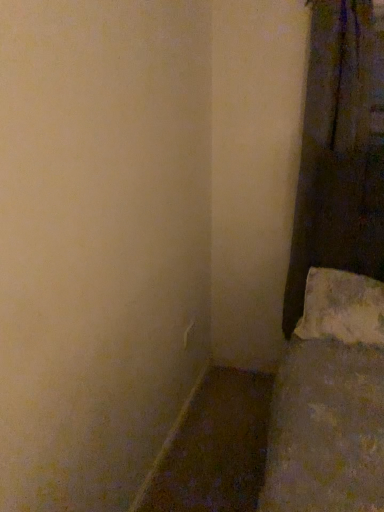
Question: From a real-world perspective, does white textured pillow at lower right sit lower than matte brown wood at lower left?

Choices:
 (A) no
 (B) yes

Answer: (A)

Question: Does white textured pillow at lower right have a greater width compared to matte brown wood at lower left?

Choices:
 (A) no
 (B) yes

Answer: (B)

Question: Does white textured pillow at lower right have a lesser width compared to matte brown wood at lower left?

Choices:
 (A) yes
 (B) no

Answer: (B)

Question: Considering the relative sizes of white textured pillow at lower right and matte brown wood at lower left in the image provided, is white textured pillow at lower right bigger than matte brown wood at lower left?

Choices:
 (A) no
 (B) yes

Answer: (B)

Question: Could matte brown wood at lower left be considered to be inside white textured pillow at lower right?

Choices:
 (A) yes
 (B) no

Answer: (B)

Question: Is white textured pillow at lower right positioned with its back to matte brown wood at lower left?

Choices:
 (A) no
 (B) yes

Answer: (A)

Question: From a real-world perspective, is matte brown wood at lower left positioned over dark fabric curtain at right based on gravity?

Choices:
 (A) no
 (B) yes

Answer: (A)

Question: Is matte brown wood at lower left beside dark fabric curtain at right?

Choices:
 (A) no
 (B) yes

Answer: (A)

Question: Is matte brown wood at lower left far from dark fabric curtain at right?

Choices:
 (A) yes
 (B) no

Answer: (A)

Question: Considering the relative sizes of matte brown wood at lower left and dark fabric curtain at right in the image provided, is matte brown wood at lower left smaller than dark fabric curtain at right?

Choices:
 (A) yes
 (B) no

Answer: (A)

Question: From a real-world perspective, is matte brown wood at lower left below dark fabric curtain at right?

Choices:
 (A) yes
 (B) no

Answer: (A)

Question: From the image's perspective, would you say matte brown wood at lower left is shown under dark fabric curtain at right?

Choices:
 (A) no
 (B) yes

Answer: (B)

Question: From the image's perspective, is matte brown wood at lower left on top of white textured pillow at lower right?

Choices:
 (A) no
 (B) yes

Answer: (A)